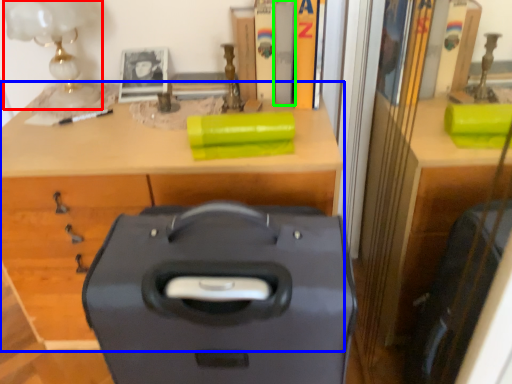
Question: Which object is the farthest from table lamp (highlighted by a red box)? Choose among these: desk (highlighted by a blue box) or book (highlighted by a green box).

Choices:
 (A) desk
 (B) book

Answer: (B)